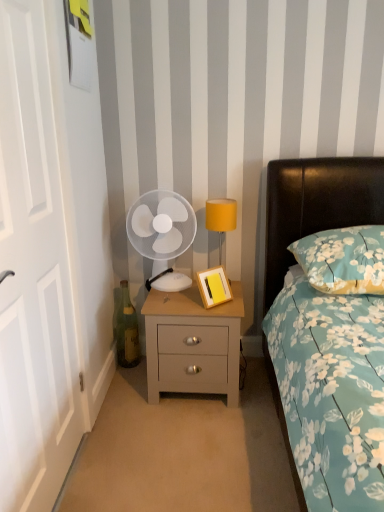
Locate an element on the screen. The height and width of the screenshot is (512, 384). vacant area that is in front of green glass bottle at lower left is located at coordinates pos(128,377).